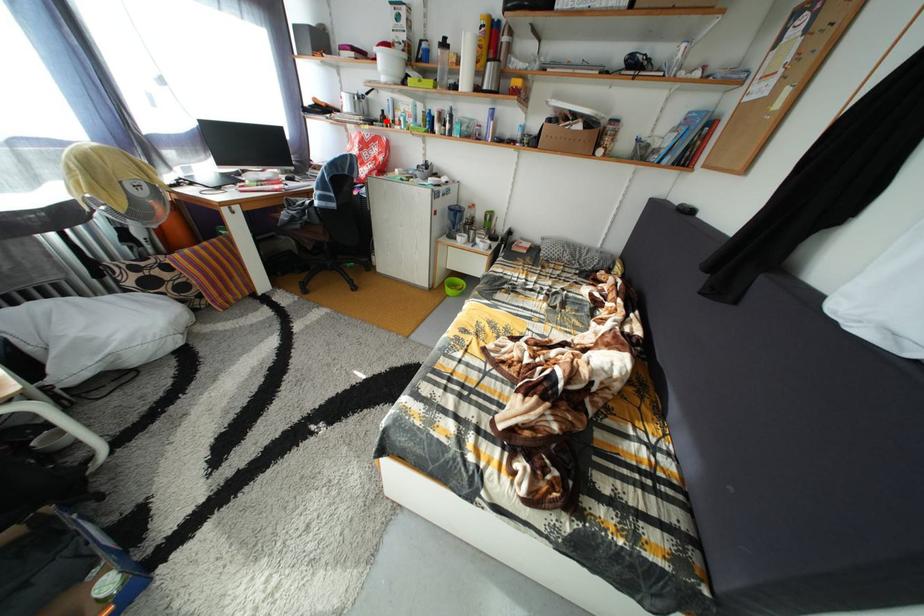
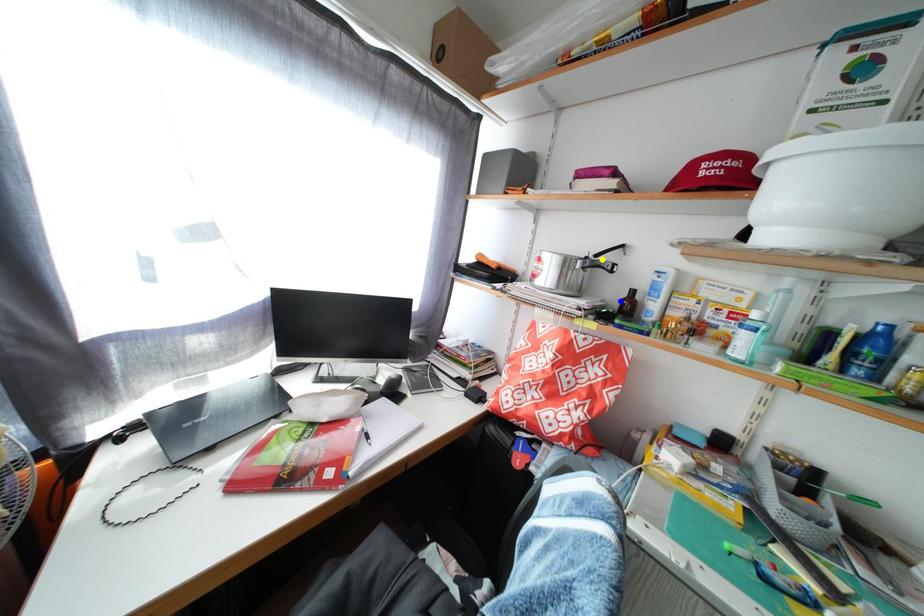
Question: I am providing you with two images of the same scene from different viewpoints. A red point is marked on the first image. You are given multiple points on the second image. Which point in image 2 is actually the same real-world point as the red point in image 1?

Choices:
 (A) blue point
 (B) yellow point
 (C) green point

Answer: (A)